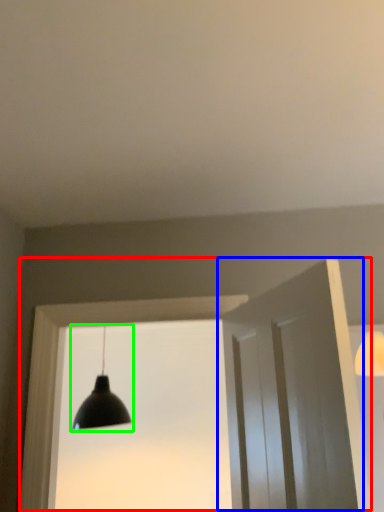
Question: Which is farther away from window frame (highlighted by a red box)? door (highlighted by a blue box) or lamp (highlighted by a green box)?

Choices:
 (A) door
 (B) lamp

Answer: (B)